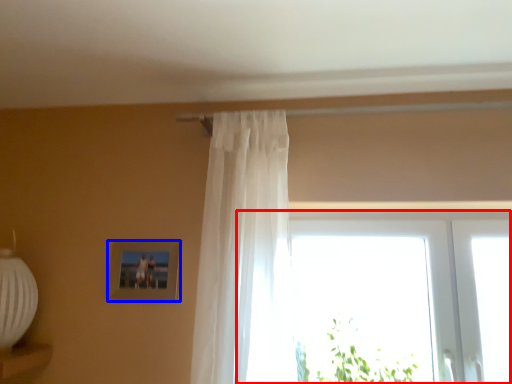
Question: Which object appears farthest to the camera in this image, window (highlighted by a red box) or picture frame (highlighted by a blue box)?

Choices:
 (A) window
 (B) picture frame

Answer: (B)